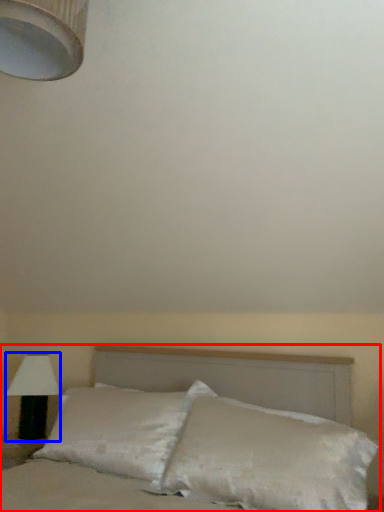
Question: Among these objects, which one is farthest to the camera, bed (highlighted by a red box) or lamp (highlighted by a blue box)?

Choices:
 (A) bed
 (B) lamp

Answer: (B)